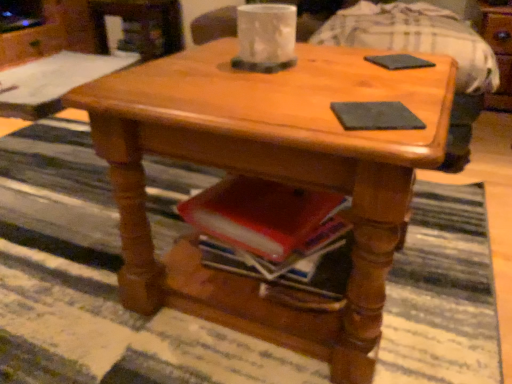
Question: From a real-world perspective, is shiny wood coffee table at center on top of black matte pad at center, acting as the 1th pad starting from the bottom?

Choices:
 (A) no
 (B) yes

Answer: (A)

Question: From the image's perspective, does shiny wood coffee table at center appear lower than black matte pad at center, acting as the 2th pad starting from the back?

Choices:
 (A) yes
 (B) no

Answer: (A)

Question: Is black matte pad at center, which is the first pad from front to back, completely or partially inside shiny wood coffee table at center?

Choices:
 (A) no
 (B) yes

Answer: (B)

Question: Is shiny wood coffee table at center smaller than black matte pad at center, acting as the 1th pad starting from the bottom?

Choices:
 (A) no
 (B) yes

Answer: (A)

Question: Can we say shiny wood coffee table at center lies outside black matte pad at center, which appears as the 2th pad when viewed from the top?

Choices:
 (A) no
 (B) yes

Answer: (B)

Question: Based on their positions, is shiny wood coffee table at center located to the left or right of matte black coaster at upper center?

Choices:
 (A) right
 (B) left

Answer: (B)

Question: Does point (199, 160) appear closer or farther from the camera than point (468, 140)?

Choices:
 (A) farther
 (B) closer

Answer: (B)

Question: From a real-world perspective, is shiny wood coffee table at center positioned above or below matte black coaster at upper center?

Choices:
 (A) above
 (B) below

Answer: (A)

Question: Considering their positions, is shiny wood coffee table at center located in front of or behind matte black coaster at upper center?

Choices:
 (A) behind
 (B) front

Answer: (B)

Question: Is black matte pad at center, marked as the 1th pad in a left-to-right arrangement, spatially inside matte black coaster at upper center, or outside of it?

Choices:
 (A) inside
 (B) outside

Answer: (B)

Question: Does point (355, 117) appear closer or farther from the camera than point (421, 36)?

Choices:
 (A) farther
 (B) closer

Answer: (B)

Question: Is black matte pad at center, which appears as the 2th pad when viewed from the top, in front of or behind matte black coaster at upper center in the image?

Choices:
 (A) behind
 (B) front

Answer: (B)

Question: Considering the relative positions of black matte pad at center, acting as the 2th pad starting from the back, and matte black coaster at upper center in the image provided, is black matte pad at center, acting as the 2th pad starting from the back, to the left or to the right of matte black coaster at upper center?

Choices:
 (A) right
 (B) left

Answer: (B)

Question: In the image, is black matte pad at center, the 2th pad from the right, on the left side or the right side of black matte pad at upper right, which appears as the 1th pad when viewed from the right?

Choices:
 (A) left
 (B) right

Answer: (A)

Question: In terms of height, does black matte pad at center, which is the first pad from front to back, look taller or shorter compared to black matte pad at upper right, placed as the 1th pad when sorted from top to bottom?

Choices:
 (A) tall
 (B) short

Answer: (B)